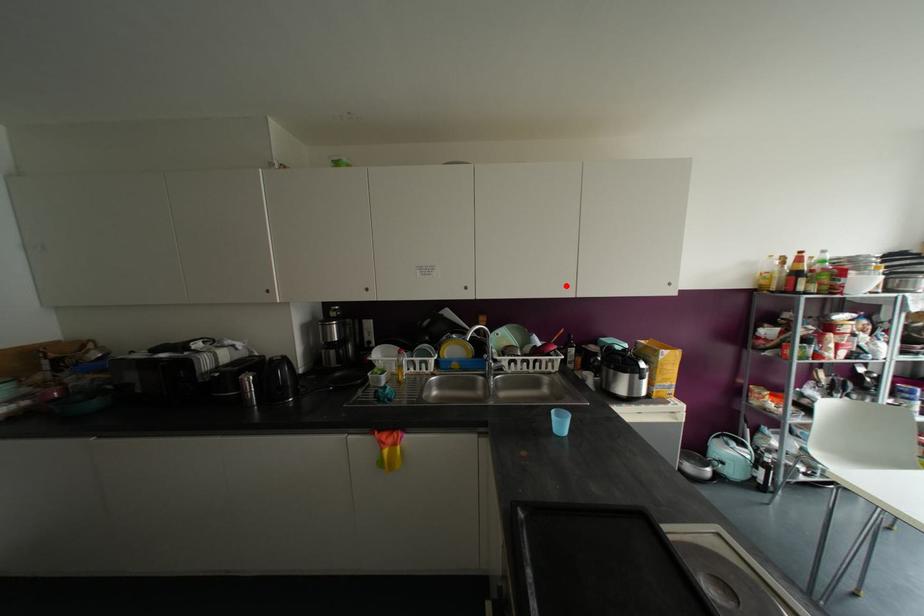
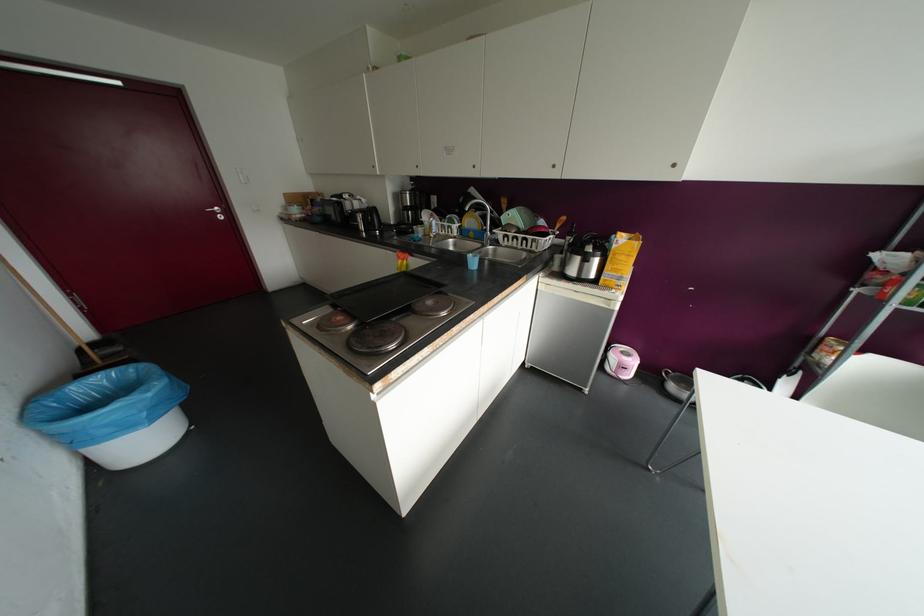
In the second image, find the point that corresponds to the highlighted location in the first image.

(553, 166)